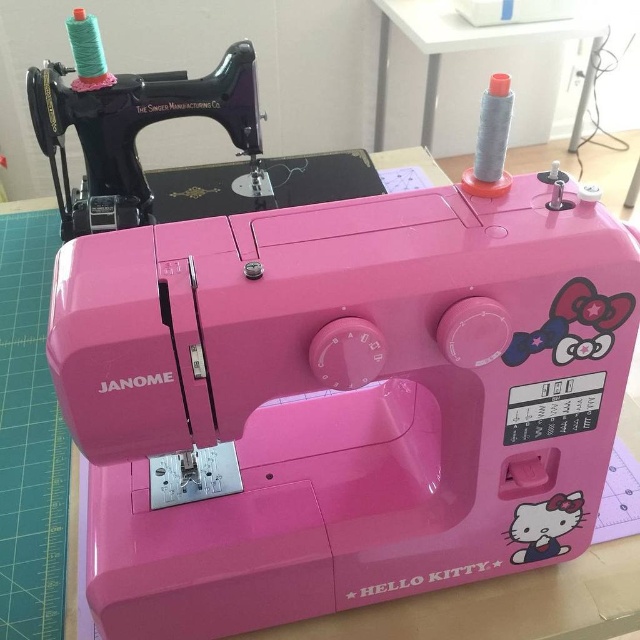
You are an interior designer trying to place a new decorative item between the pink plastic sewing machine at upper left and the gray fabric spool at upper right. Based on their positions, which side should you place it to ensure it is centered between them?

The pink plastic sewing machine at upper left is to the left of the gray fabric spool at upper right, so placing the decorative item in the middle between them would require positioning it between the two objects along the horizontal axis, centered between their left and right edges.

You are looking at the sewing machine and want to place a decorative sticker. You have two points to choose from on the machine, point (212,204) and point (385,76). Which point is closer to you and better for visibility?

Point (212,204) is closer to the viewer than point (385,76), so it is better for visibility.